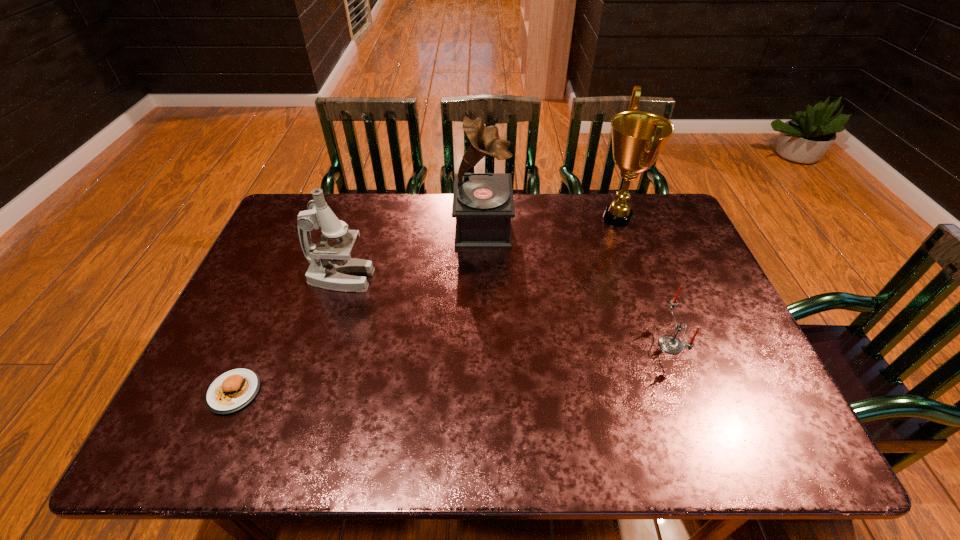
Locate an element on the screen. The height and width of the screenshot is (540, 960). free space at the far right corner is located at coordinates (646, 199).

Identify the location of vacant region between the third object from left to right and the leftmost object. (358, 309).

Identify the location of unoccupied position between the candle and the third object from right to left. (577, 286).

Locate an element on the screen. vacant area that lies between the nearest object and the microscope is located at coordinates (288, 335).

Identify the location of free area in between the third farthest object and the food. Image resolution: width=960 pixels, height=540 pixels. (288, 335).

The width and height of the screenshot is (960, 540). Identify the location of free space between the award and the third object from right to left. (550, 222).

Identify the location of empty location between the third tallest object and the fourth farthest object. This screenshot has height=540, width=960. (506, 312).

The image size is (960, 540). I want to click on vacant area that lies between the third object from right to left and the nearest object, so click(x=358, y=309).

This screenshot has width=960, height=540. I want to click on unoccupied position between the third nearest object and the leftmost object, so click(288, 335).

Where is `unoccupied position between the third nearest object and the nearest object`? The width and height of the screenshot is (960, 540). unoccupied position between the third nearest object and the nearest object is located at coordinates (288, 335).